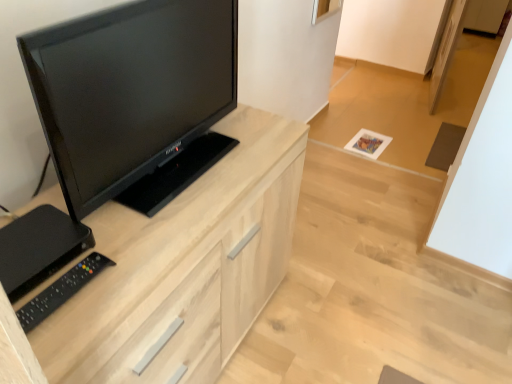
This screenshot has height=384, width=512. Identify the location of vacant area that lies to the right of black plastic remote at lower left. pos(125,282).